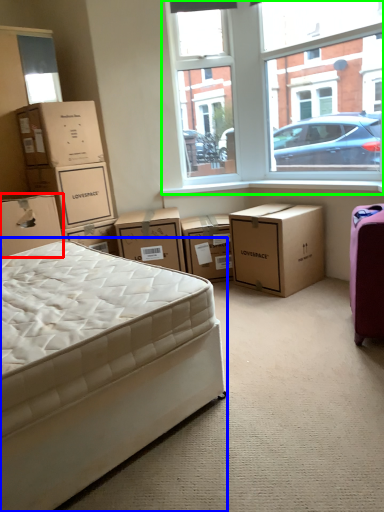
Question: Which object is the farthest from box (highlighted by a red box)? Choose among these: bed (highlighted by a blue box) or window (highlighted by a green box).

Choices:
 (A) bed
 (B) window

Answer: (B)